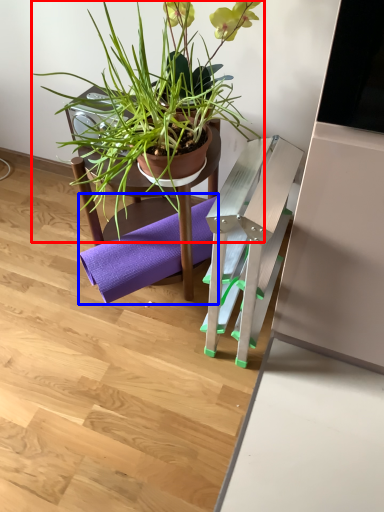
Question: Which of the following is the closest to the observer, houseplant (highlighted by a red box) or yoga mat (highlighted by a blue box)?

Choices:
 (A) houseplant
 (B) yoga mat

Answer: (A)